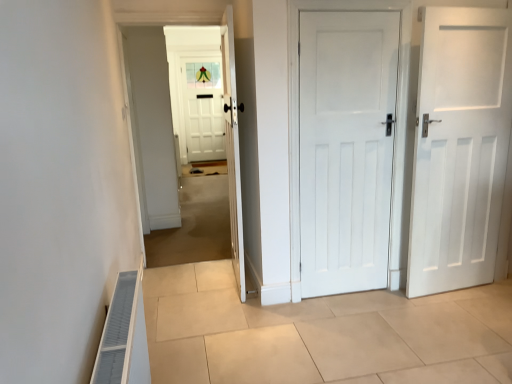
Question: Can you confirm if white wooden door at center, placed as the first door when sorted from left to right, is positioned to the left of white painted wood door at center, positioned as the second door in left-to-right order?

Choices:
 (A) yes
 (B) no

Answer: (A)

Question: Is white wooden door at center, placed as the first door when sorted from left to right, shorter than white painted wood door at center, the second door when ordered from right to left?

Choices:
 (A) yes
 (B) no

Answer: (B)

Question: Is white wooden door at center, placed as the third door when sorted from right to left, behind white painted wood door at center, positioned as the second door in left-to-right order?

Choices:
 (A) yes
 (B) no

Answer: (B)

Question: From the image's perspective, does white wooden door at center, placed as the first door when sorted from left to right, appear higher than white painted wood door at center, the second door when ordered from right to left?

Choices:
 (A) yes
 (B) no

Answer: (A)

Question: Can you confirm if white wooden door at center, placed as the first door when sorted from left to right, is smaller than white painted wood door at center, the second door when ordered from right to left?

Choices:
 (A) yes
 (B) no

Answer: (B)

Question: Based on their positions, is white painted wood door at center, positioned as the second door in left-to-right order, located to the left or right of white wooden door at center?

Choices:
 (A) left
 (B) right

Answer: (B)

Question: Relative to white wooden door at center, is white painted wood door at center, the second door when ordered from right to left, in front or behind?

Choices:
 (A) front
 (B) behind

Answer: (A)

Question: In terms of size, does white painted wood door at center, the second door when ordered from right to left, appear bigger or smaller than white wooden door at center?

Choices:
 (A) small
 (B) big

Answer: (A)

Question: Considering the positions of white painted wood door at center, the second door when ordered from right to left, and white wooden door at center in the image, is white painted wood door at center, the second door when ordered from right to left, wider or thinner than white wooden door at center?

Choices:
 (A) thin
 (B) wide

Answer: (A)

Question: Considering the positions of point (436, 170) and point (232, 69), is point (436, 170) closer or farther from the camera than point (232, 69)?

Choices:
 (A) farther
 (B) closer

Answer: (A)

Question: From their relative heights in the image, would you say white matte door at right, arranged as the first door when viewed from the right, is taller or shorter than white wooden door at center, placed as the third door when sorted from right to left?

Choices:
 (A) tall
 (B) short

Answer: (B)

Question: Is white matte door at right, arranged as the first door when viewed from the right, inside the boundaries of white wooden door at center, placed as the first door when sorted from left to right, or outside?

Choices:
 (A) outside
 (B) inside

Answer: (A)

Question: Based on their sizes in the image, would you say white matte door at right, which ranks as the 3th door in left-to-right order, is bigger or smaller than white wooden door at center, placed as the third door when sorted from right to left?

Choices:
 (A) big
 (B) small

Answer: (B)

Question: In the image, is beige tile floor at center positioned in front of or behind white wooden door at center, placed as the first door when sorted from left to right?

Choices:
 (A) behind
 (B) front

Answer: (B)

Question: Considering the relative positions of beige tile floor at center and white wooden door at center, placed as the first door when sorted from left to right, in the image provided, is beige tile floor at center to the left or to the right of white wooden door at center, placed as the first door when sorted from left to right,?

Choices:
 (A) left
 (B) right

Answer: (B)